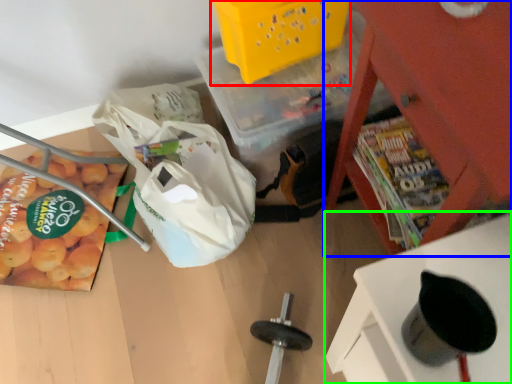
Question: Considering the real-world distances, which object is farthest from basket (highlighted by a red box)? furniture (highlighted by a blue box) or furniture (highlighted by a green box)?

Choices:
 (A) furniture
 (B) furniture

Answer: (B)